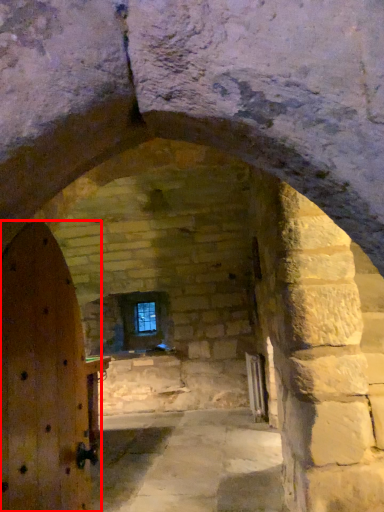
Question: Observing the image, what is the correct spatial positioning of door (annotated by the red box) in reference to window?

Choices:
 (A) left
 (B) right

Answer: (B)